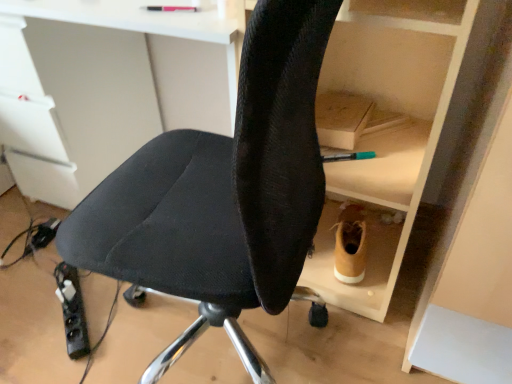
Question: Is black fabric chair at center far away from black plastic power strip at lower left?

Choices:
 (A) no
 (B) yes

Answer: (A)

Question: Is black fabric chair at center positioned before black plastic power strip at lower left?

Choices:
 (A) no
 (B) yes

Answer: (B)

Question: From the image's perspective, does black fabric chair at center appear lower than black plastic power strip at lower left?

Choices:
 (A) yes
 (B) no

Answer: (B)

Question: Is black fabric chair at center looking in the opposite direction of black plastic power strip at lower left?

Choices:
 (A) yes
 (B) no

Answer: (B)

Question: Is black fabric chair at center thinner than black plastic power strip at lower left?

Choices:
 (A) no
 (B) yes

Answer: (A)

Question: From a real-world perspective, is black plastic power strip at lower left positioned above or below tan suede boot at lower right?

Choices:
 (A) below
 (B) above

Answer: (A)

Question: Considering the relative positions of black plastic power strip at lower left and tan suede boot at lower right in the image provided, is black plastic power strip at lower left to the left or to the right of tan suede boot at lower right?

Choices:
 (A) right
 (B) left

Answer: (B)

Question: From the image's perspective, is black plastic power strip at lower left positioned above or below tan suede boot at lower right?

Choices:
 (A) above
 (B) below

Answer: (B)

Question: In terms of height, does black plastic power strip at lower left look taller or shorter compared to tan suede boot at lower right?

Choices:
 (A) short
 (B) tall

Answer: (A)

Question: Which is correct: black plastic power strip at lower left is inside black fabric chair at center, or outside of it?

Choices:
 (A) outside
 (B) inside

Answer: (A)

Question: Relative to black fabric chair at center, is black plastic power strip at lower left in front or behind?

Choices:
 (A) behind
 (B) front

Answer: (A)

Question: Is black plastic power strip at lower left bigger or smaller than black fabric chair at center?

Choices:
 (A) big
 (B) small

Answer: (B)

Question: From a real-world perspective, relative to black fabric chair at center, is black plastic power strip at lower left vertically above or below?

Choices:
 (A) above
 (B) below

Answer: (B)

Question: Is point (178, 175) positioned closer to the camera than point (362, 261)?

Choices:
 (A) farther
 (B) closer

Answer: (B)

Question: Do you think black fabric chair at center is within tan suede boot at lower right, or outside of it?

Choices:
 (A) outside
 (B) inside

Answer: (A)